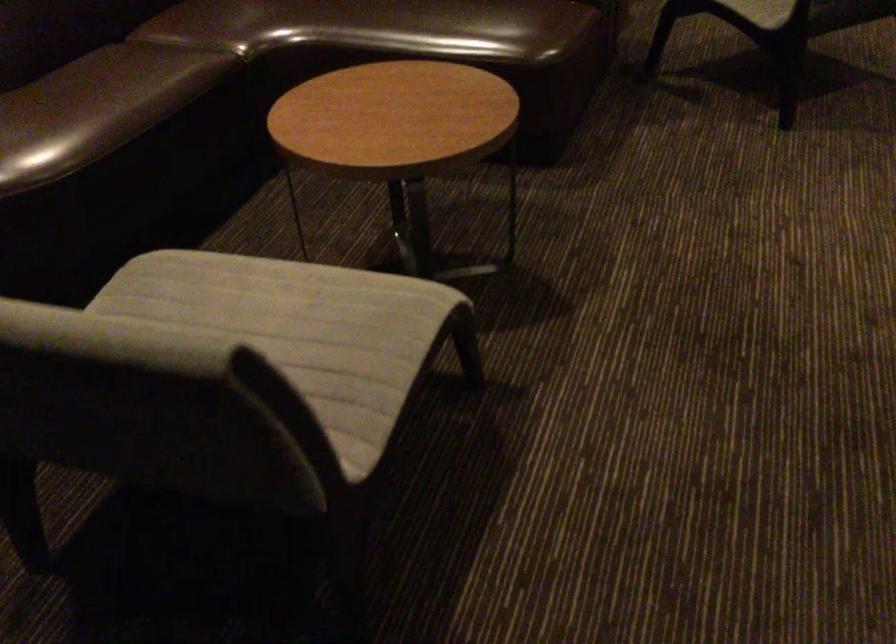
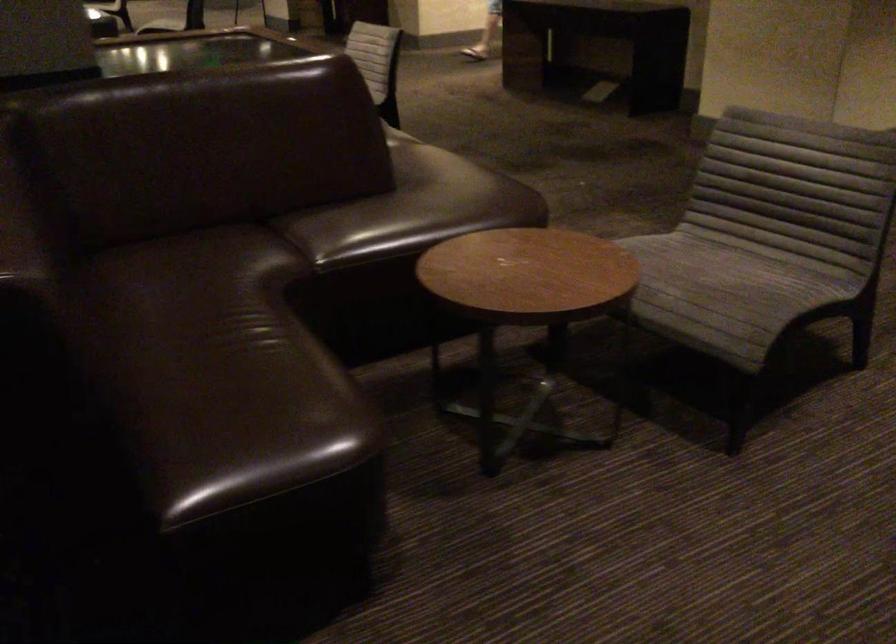
Question: I am providing you with two images of the same scene from different viewpoints. Please identify which objects are invisible in image2.

Choices:
 (A) sofa sitting surface
 (B) blue paper roll
 (C) 新物体
 (D) grey chair sitting surface

Answer: (C)